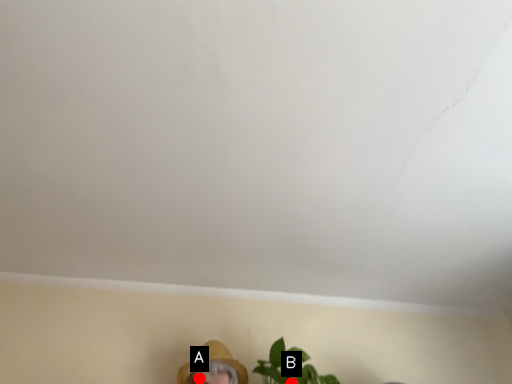
Question: Two points are circled on the image, labeled by A and B beside each circle. Among these points, which one is nearest to the camera?

Choices:
 (A) A is closer
 (B) B is closer

Answer: (B)